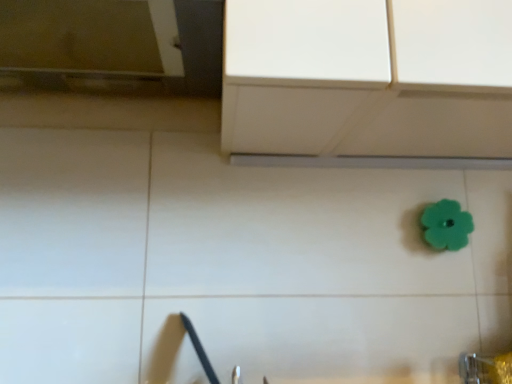
Locate an element on the screen. This screenshot has height=384, width=512. teal rubber flower at center-right is located at coordinates (446, 225).

Describe the element at coordinates (446, 225) in the screenshot. The width and height of the screenshot is (512, 384). I see `teal rubber flower at center-right` at that location.

The height and width of the screenshot is (384, 512). What do you see at coordinates (477, 369) in the screenshot?
I see `metallic silver faucet at lower right` at bounding box center [477, 369].

What is the approximate width of metallic silver faucet at lower right?

The width of metallic silver faucet at lower right is 3.27 inches.

Where is `metallic silver faucet at lower right`? Image resolution: width=512 pixels, height=384 pixels. metallic silver faucet at lower right is located at coordinates [x=477, y=369].

You are a GUI agent. You are given a task and a screenshot of the screen. Output one action in this format:
    pyautogui.click(x=<x>, y=<y>)
    Task: Click on the teal rubber flower at center-right
    
    Given the screenshot: What is the action you would take?
    pyautogui.click(x=446, y=225)

Can you confirm if teal rubber flower at center-right is positioned to the right of metallic silver faucet at lower right?

Yes.

Considering the positions of objects teal rubber flower at center-right and metallic silver faucet at lower right in the image provided, who is in front, teal rubber flower at center-right or metallic silver faucet at lower right?

metallic silver faucet at lower right is more forward.

Is point (429, 219) positioned after point (489, 374)?

Yes.

From the image's perspective, between teal rubber flower at center-right and metallic silver faucet at lower right, who is located below?

From the image's view, metallic silver faucet at lower right is below.

Based on the photo, from a real-world perspective, who is located higher, teal rubber flower at center-right or metallic silver faucet at lower right?

From a 3D spatial view, teal rubber flower at center-right is above.

Between teal rubber flower at center-right and metallic silver faucet at lower right, which one has smaller width?

Thinner between the two is teal rubber flower at center-right.

Does teal rubber flower at center-right have a lesser height compared to metallic silver faucet at lower right?

Indeed, teal rubber flower at center-right has a lesser height compared to metallic silver faucet at lower right.

Who is smaller, teal rubber flower at center-right or metallic silver faucet at lower right?

Smaller between the two is teal rubber flower at center-right.

Is teal rubber flower at center-right not within metallic silver faucet at lower right?

Yes, teal rubber flower at center-right is not within metallic silver faucet at lower right.

Are teal rubber flower at center-right and metallic silver faucet at lower right far apart?

No, teal rubber flower at center-right is not far away from metallic silver faucet at lower right.

Could you tell me if teal rubber flower at center-right is facing metallic silver faucet at lower right?

No, teal rubber flower at center-right does not turn towards metallic silver faucet at lower right.

What's the angular difference between teal rubber flower at center-right and metallic silver faucet at lower right's facing directions?

teal rubber flower at center-right and metallic silver faucet at lower right are facing 2.92 degrees away from each other.

The height and width of the screenshot is (384, 512). I want to click on flower behind the metallic silver faucet at lower right, so click(446, 225).

Between metallic silver faucet at lower right and teal rubber flower at center-right, which one appears on the left side from the viewer's perspective?

metallic silver faucet at lower right.

Is the depth of metallic silver faucet at lower right greater than that of teal rubber flower at center-right?

No, it is not.

Which point is more forward, (x=463, y=360) or (x=437, y=247)?

Point (x=463, y=360)

From the image's perspective, is metallic silver faucet at lower right located above teal rubber flower at center-right?

Incorrect, from the image's perspective, metallic silver faucet at lower right is lower than teal rubber flower at center-right.

From a real-world perspective, relative to teal rubber flower at center-right, is metallic silver faucet at lower right vertically above or below?

Clearly, from a real-world perspective, metallic silver faucet at lower right is below teal rubber flower at center-right.

Based on the photo, which of these two, metallic silver faucet at lower right or teal rubber flower at center-right, is wider?

metallic silver faucet at lower right.

Is metallic silver faucet at lower right shorter than teal rubber flower at center-right?

In fact, metallic silver faucet at lower right may be taller than teal rubber flower at center-right.

Between metallic silver faucet at lower right and teal rubber flower at center-right, which one has smaller size?

With smaller size is teal rubber flower at center-right.

Would you say teal rubber flower at center-right is part of metallic silver faucet at lower right's contents?

No, metallic silver faucet at lower right does not contain teal rubber flower at center-right.

Is metallic silver faucet at lower right touching teal rubber flower at center-right?

metallic silver faucet at lower right and teal rubber flower at center-right are not in contact.

Is metallic silver faucet at lower right oriented towards teal rubber flower at center-right?

No, metallic silver faucet at lower right does not turn towards teal rubber flower at center-right.

Where is `faucet below the teal rubber flower at center-right (from the image's perspective)`? This screenshot has height=384, width=512. faucet below the teal rubber flower at center-right (from the image's perspective) is located at coordinates (477, 369).

The image size is (512, 384). In order to click on faucet below the teal rubber flower at center-right (from the image's perspective) in this screenshot , I will do `click(477, 369)`.

Locate an element on the screen. flower above the metallic silver faucet at lower right (from the image's perspective) is located at coordinates (446, 225).